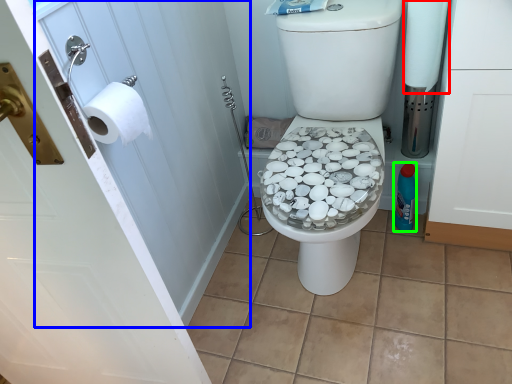
Question: Which object is the farthest from toilet paper (highlighted by a red box)? Choose among these: screen door (highlighted by a blue box) or bottle (highlighted by a green box).

Choices:
 (A) screen door
 (B) bottle

Answer: (A)